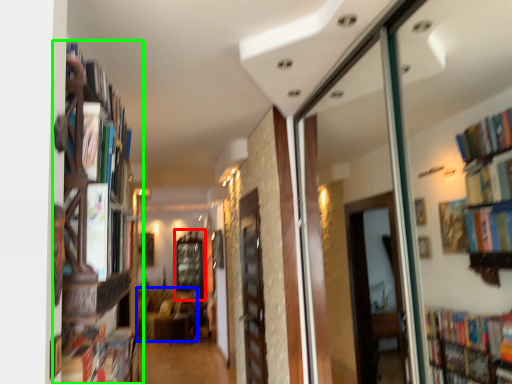
Question: Estimate the real-world distances between objects in this image. Which object is closer to window (highlighted by a red box), furniture (highlighted by a blue box) or bookcase (highlighted by a green box)?

Choices:
 (A) furniture
 (B) bookcase

Answer: (A)